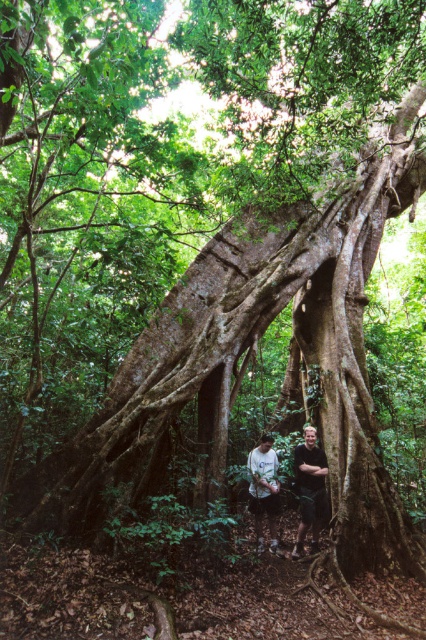
Question: Is white t-shirt at center further to the viewer compared to dark green t-shirt at center?

Choices:
 (A) yes
 (B) no

Answer: (B)

Question: Which point appears closest to the camera in this image?

Choices:
 (A) tap(317, 536)
 (B) tap(256, 452)

Answer: (B)

Question: Is dark green t-shirt at center positioned behind white matte shirt at center?

Choices:
 (A) yes
 (B) no

Answer: (A)

Question: Is white t-shirt at center smaller than dark green t-shirt at center?

Choices:
 (A) yes
 (B) no

Answer: (B)

Question: Which point is farther from the camera taking this photo?

Choices:
 (A) click(x=252, y=449)
 (B) click(x=293, y=548)

Answer: (A)

Question: Which point is closer to the camera?

Choices:
 (A) dark green t-shirt at center
 (B) white matte shirt at center

Answer: (B)